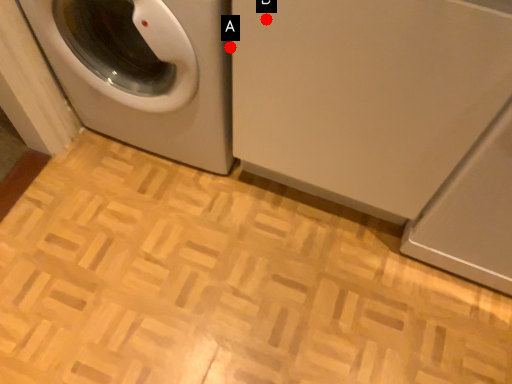
Question: Two points are circled on the image, labeled by A and B beside each circle. Which point is farther to the camera?

Choices:
 (A) A is further
 (B) B is further

Answer: (A)